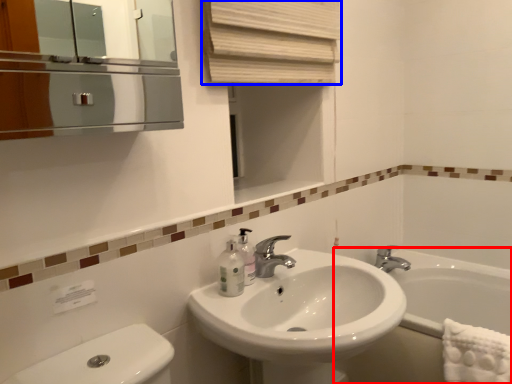
Question: Which point is closer to the camera, bath (highlighted by a red box) or curtain (highlighted by a blue box)?

Choices:
 (A) bath
 (B) curtain

Answer: (B)